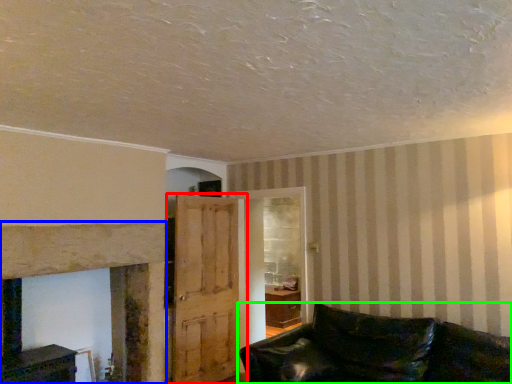
Question: Considering the real-world distances, which object is farthest from door (highlighted by a red box)? fireplace (highlighted by a blue box) or studio couch (highlighted by a green box)?

Choices:
 (A) fireplace
 (B) studio couch

Answer: (B)